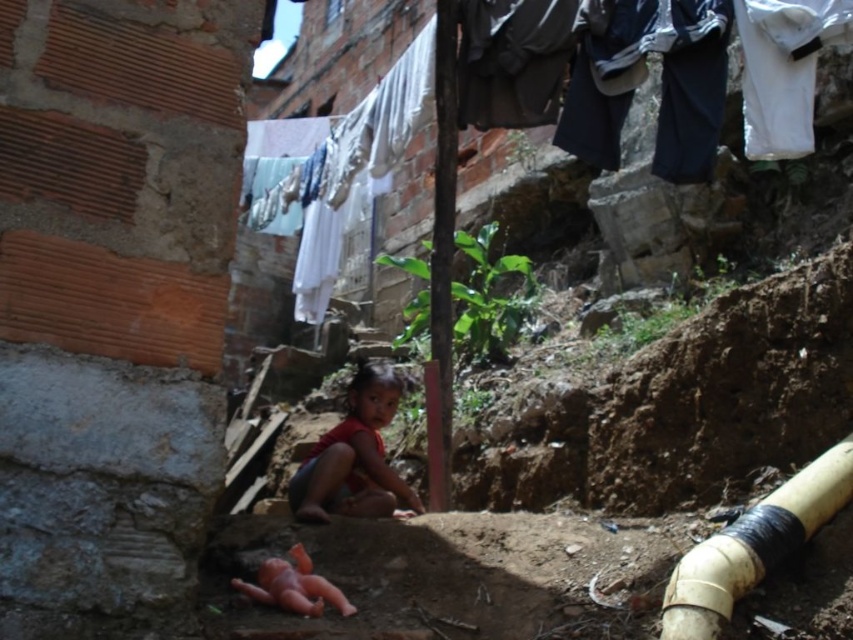
Describe the element at coordinates (753, 545) in the screenshot. I see `yellow matte water pipe at lower right` at that location.

Is the position of yellow matte water pipe at lower right less distant than that of red matte dress at center?

Yes.

Is point (676, 582) farther from camera compared to point (300, 474)?

No, (676, 582) is closer to viewer.

At what (x,y) coordinates should I click in order to perform the action: click on yellow matte water pipe at lower right. Please return your answer as a coordinate pair (x, y). Image resolution: width=853 pixels, height=640 pixels. Looking at the image, I should click on (753, 545).